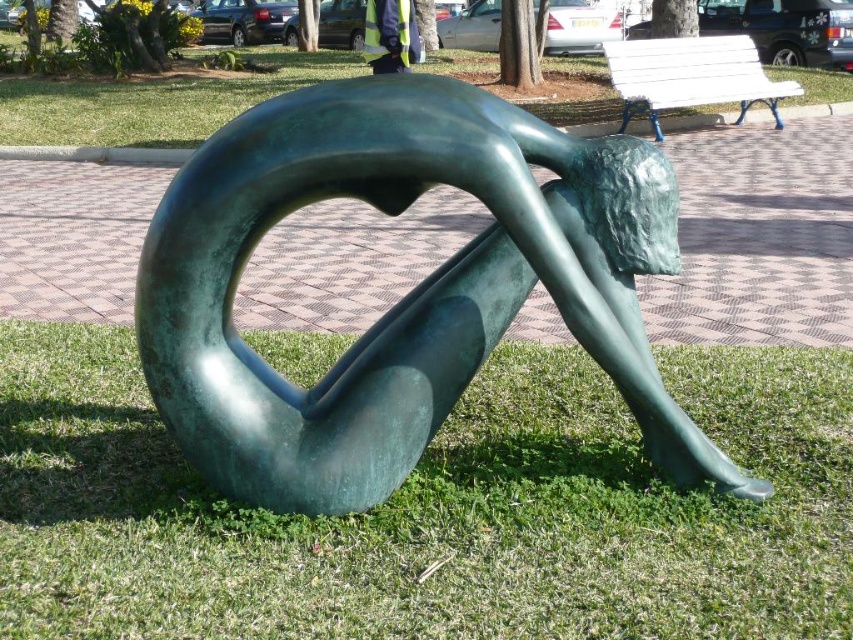
Which is in front, point (618, 496) or point (641, 68)?

Point (618, 496) is in front.

Is point (671, 598) closer to viewer compared to point (718, 65)?

Yes, point (671, 598) is closer to viewer.

This screenshot has width=853, height=640. In order to click on green grass at lower center in this screenshot , I will do `click(432, 509)`.

Between green patina sculpture at center and yellow reflective vest at center, which one appears on the right side from the viewer's perspective?

Positioned to the right is green patina sculpture at center.

Where is `green patina sculpture at center`? green patina sculpture at center is located at coordinates (408, 292).

Locate an element on the screen. The height and width of the screenshot is (640, 853). green patina sculpture at center is located at coordinates (408, 292).

Is green grass at lower center to the right of green patina sculpture at center from the viewer's perspective?

In fact, green grass at lower center is to the left of green patina sculpture at center.

Does green grass at lower center come behind green patina sculpture at center?

No, green grass at lower center is closer to the viewer.

Identify the location of green grass at lower center. This screenshot has width=853, height=640. tap(432, 509).

Find the location of a particular element. green grass at lower center is located at coordinates (432, 509).